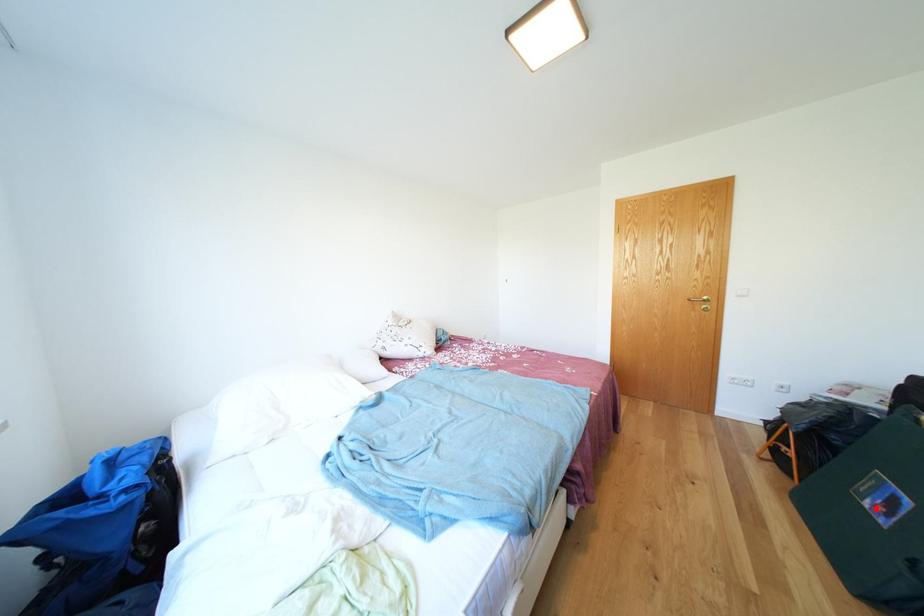
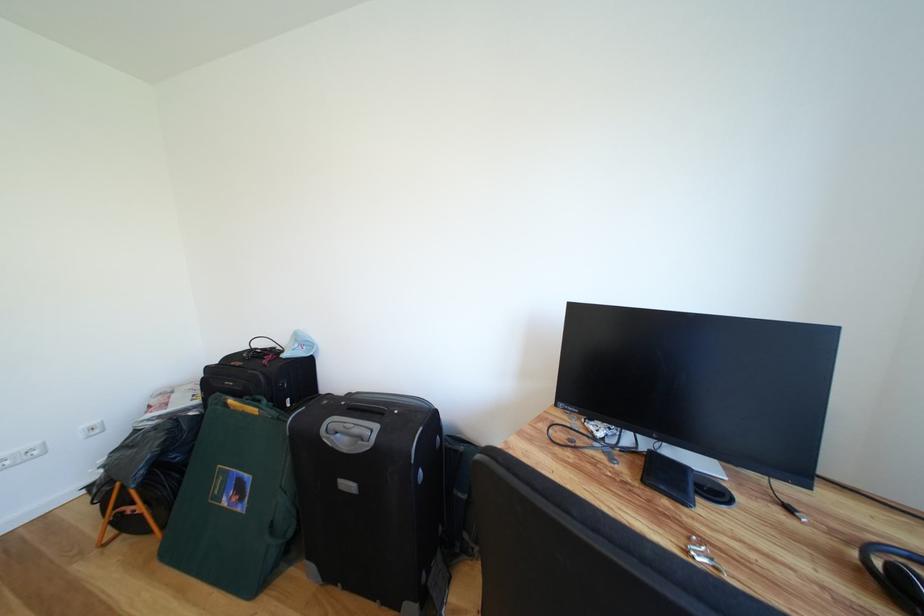
Question: I am providing you with two images of the same scene from different viewpoints. A red point is marked on the first image. At the location where the point appears in image 1, is it still visible in image 2?

Choices:
 (A) Yes
 (B) No

Answer: (A)